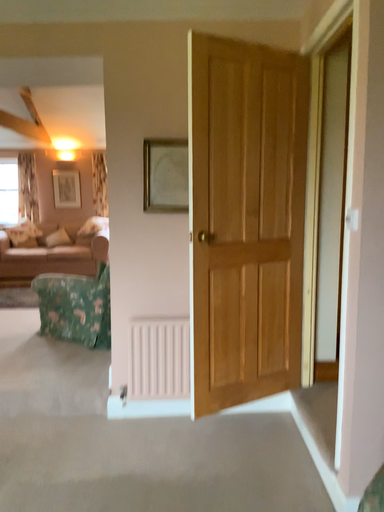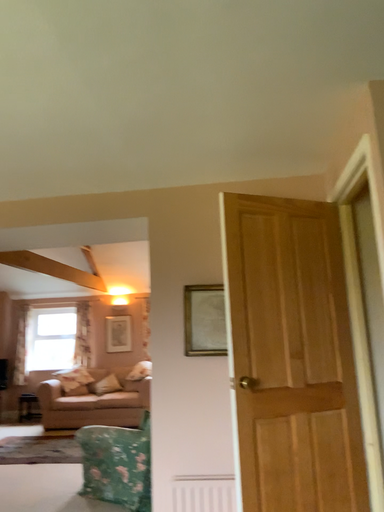
Question: Which way did the camera rotate in the video?

Choices:
 (A) rotated left
 (B) rotated right

Answer: (A)